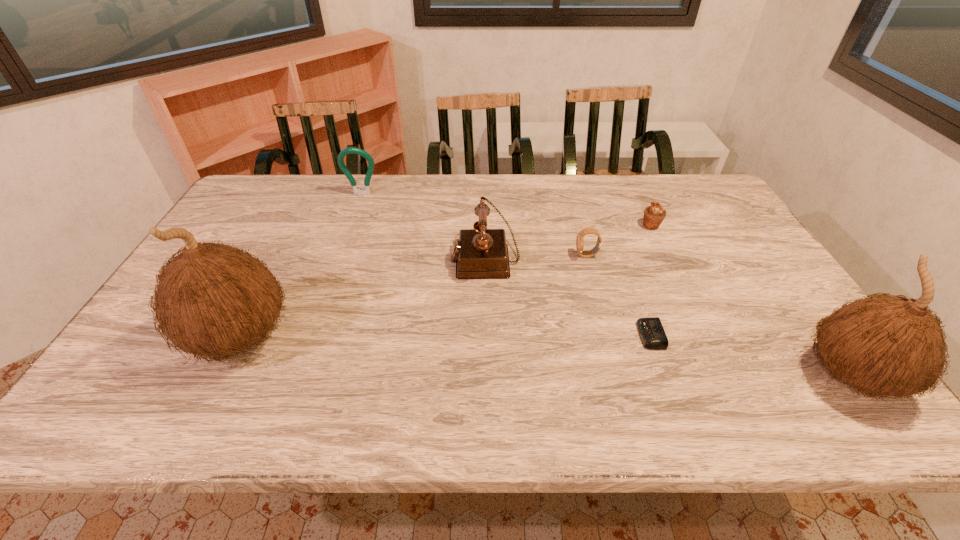
Where is `the fifth object from left to right`? This screenshot has width=960, height=540. the fifth object from left to right is located at coordinates (652, 334).

Find the location of `vacant space located on the surface of the left coconut`. vacant space located on the surface of the left coconut is located at coordinates (142, 338).

Find the location of `free location located on the surface of the left coconut`. free location located on the surface of the left coconut is located at coordinates (138, 338).

Locate an element on the screen. Image resolution: width=960 pixels, height=540 pixels. free space located at the jaws of the farthest object is located at coordinates pos(356,211).

Where is `vacant space located 0.080m on the left of the muffin`? The image size is (960, 540). vacant space located 0.080m on the left of the muffin is located at coordinates (615, 226).

The width and height of the screenshot is (960, 540). In order to click on vacant space situated 0.270m on the face of the fourth object from left to right in this screenshot , I will do `click(484, 255)`.

This screenshot has width=960, height=540. Identify the location of vacant space located 0.310m on the face of the fourth object from left to right. (469, 255).

Where is `vacant space located 0.120m on the face of the fourth object from left to right`? vacant space located 0.120m on the face of the fourth object from left to right is located at coordinates (535, 255).

I want to click on vacant space located on the dial of the telephone, so click(403, 258).

The width and height of the screenshot is (960, 540). Identify the location of vacant space located 0.210m on the dial of the telephone. (379, 258).